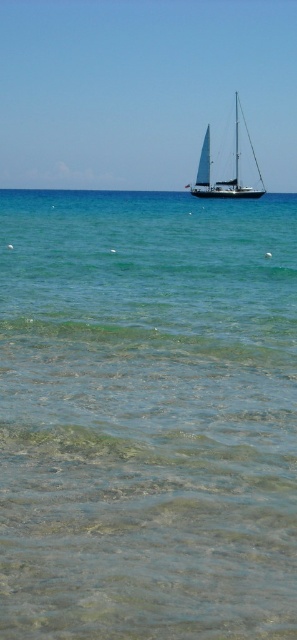
Question: Which point is closer to the camera?

Choices:
 (A) clear water at center
 (B) white sailboat at center

Answer: (A)

Question: Among these points, which one is nearest to the camera?

Choices:
 (A) (7, 392)
 (B) (231, 180)

Answer: (A)

Question: Is clear water at center above white sailboat at center?

Choices:
 (A) yes
 (B) no

Answer: (B)

Question: Is clear water at center to the right of white sailboat at center from the viewer's perspective?

Choices:
 (A) yes
 (B) no

Answer: (B)

Question: Does clear water at center have a larger size compared to white sailboat at center?

Choices:
 (A) yes
 (B) no

Answer: (B)